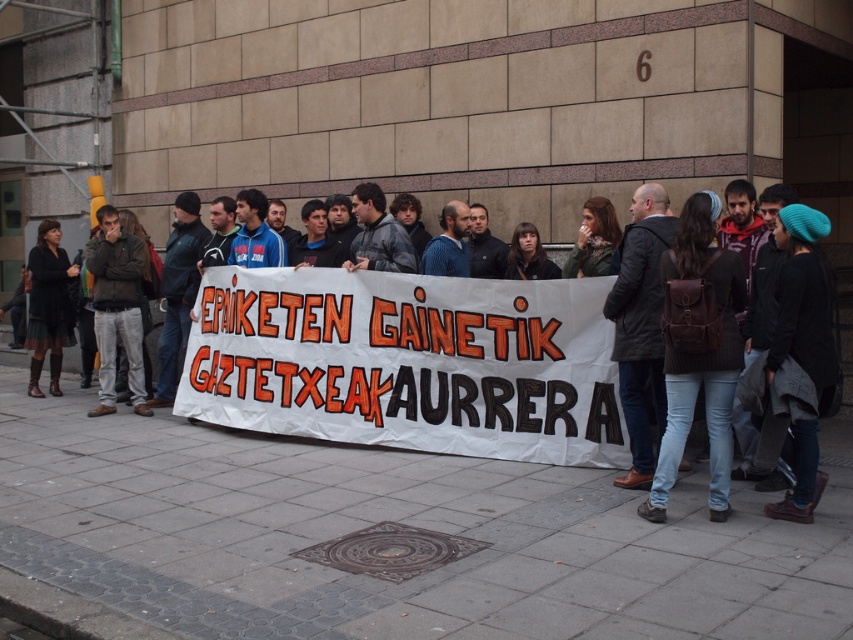
You are a photographer trying to capture a group photo of the dark blue knit hat at center and the matte black dress at left. If you want to ensure both objects are clearly visible in the frame, which object should you focus on first, considering their sizes?

The dark blue knit hat at center has a larger width than the matte black dress at left, so you should focus on the dark blue knit hat at center first to ensure it is clearly visible before adjusting for the smaller matte black dress at left.

You are a photographer standing in front of the group holding the banner. You notice two people wearing a dark brown leather jacket at left and a matte black dress at left. Which one is more to the left?

The matte black dress at left is more to the left because the dark brown leather jacket at left is positioned on the right side of it.